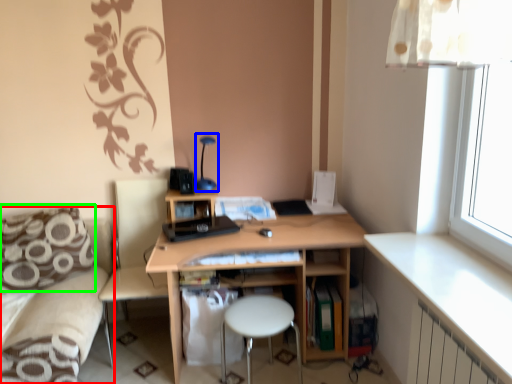
Question: Which object is positioned closest to couch (highlighted by a red box)? Select from table lamp (highlighted by a blue box) and pillow (highlighted by a green box).

Choices:
 (A) table lamp
 (B) pillow

Answer: (B)